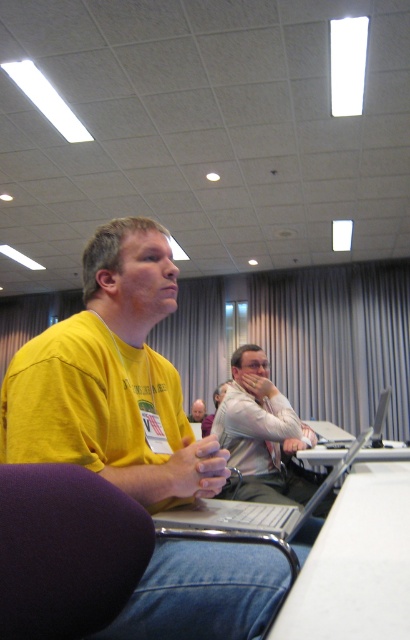
Question: From the image, what is the correct spatial relationship of silver metallic laptop at center in relation to light brown hair at center?

Choices:
 (A) left
 (B) right

Answer: (B)

Question: Is light beige shirt at center thinner than light brown hair at center?

Choices:
 (A) yes
 (B) no

Answer: (B)

Question: Which object is farther from the camera taking this photo?

Choices:
 (A) purple fabric chair at lower left
 (B) silver metallic laptop at center
 (C) light beige shirt at center
 (D) light brown hair at center

Answer: (D)

Question: Which of the following is the closest to the observer?

Choices:
 (A) silver metallic laptop at center
 (B) light brown hair at center
 (C) light beige shirt at center

Answer: (A)

Question: Where is purple fabric chair at lower left located in relation to light brown hair at center in the image?

Choices:
 (A) right
 (B) left

Answer: (A)

Question: Considering the real-world distances, which object is closest to the light brown hair at center?

Choices:
 (A) purple fabric chair at lower left
 (B) yellow t-shirt at center
 (C) silver metallic laptop at center
 (D) light beige shirt at center

Answer: (D)